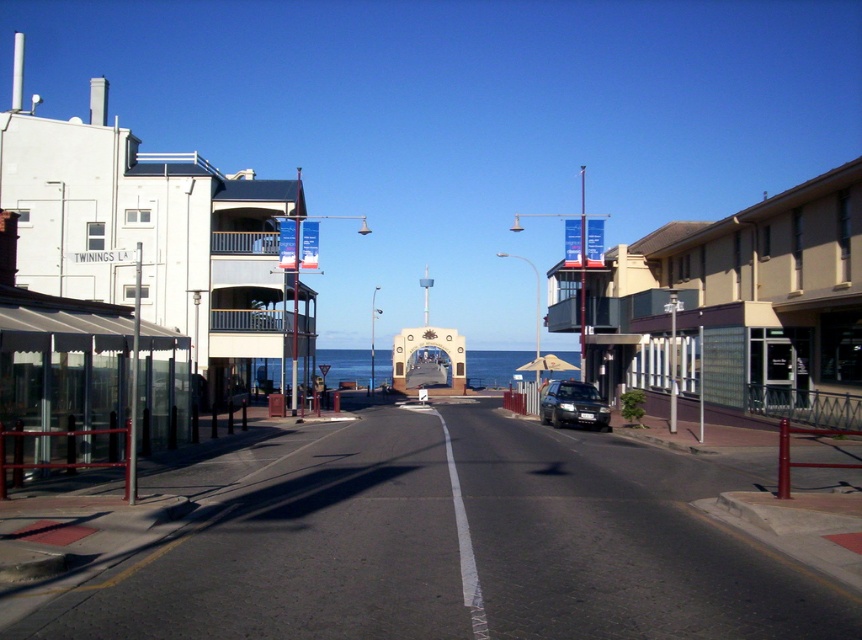
Does beige concrete building at right appear on the left side of satin silver sedan at center?

No, beige concrete building at right is not to the left of satin silver sedan at center.

Is beige concrete building at right shorter than satin silver sedan at center?

No, beige concrete building at right is not shorter than satin silver sedan at center.

Who is more forward, (609, 337) or (553, 381)?

Point (609, 337)

You are a GUI agent. You are given a task and a screenshot of the screen. Output one action in this format:
    pyautogui.click(x=<x>, y=<y>)
    Task: Click on the beige concrete building at right
    The width and height of the screenshot is (862, 640).
    Given the screenshot: What is the action you would take?
    pyautogui.click(x=741, y=305)